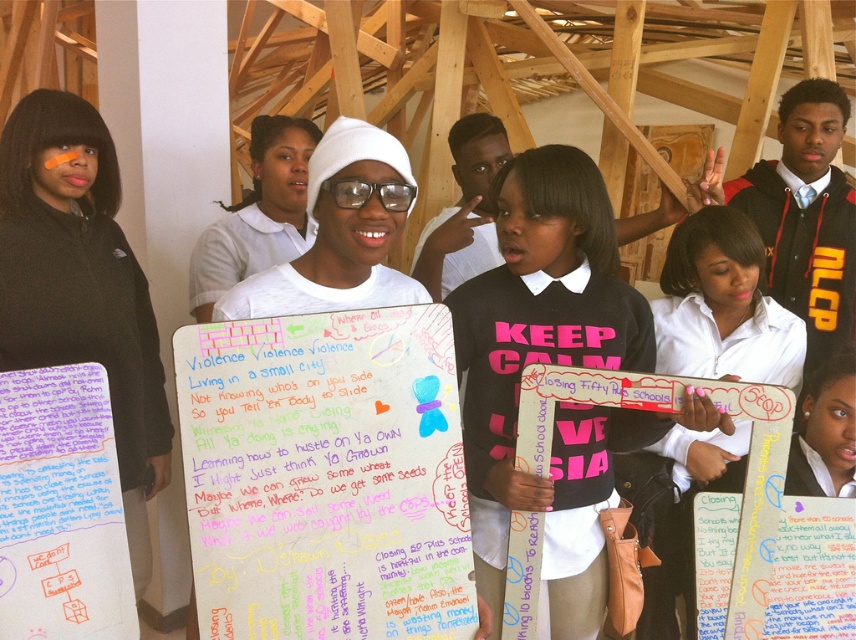
You are a photographer trying to capture the handwritten paper at center and the white matte shirt at center in the same frame. Which object should you focus on first to ensure both are in focus?

Since the handwritten paper at center is smaller than the white matte shirt at center, you should focus on the white matte shirt at center first to ensure both are in focus.

You are standing in the workshop and want to read the text on the white paper poster at center. Is the poster within a comfortable reading distance for you?

The white paper poster at center is 4.14 feet away from the viewer. A comfortable reading distance is typically around 12 to 16 inches, so the poster is too far away to read comfortably.

You are a photographer trying to capture the handwritten paper at center and the white matte shirt at center in a single shot. Based on their positions, which object is closer to the camera?

The handwritten paper at center is positioned under the white matte shirt at center, so the white matte shirt at center is closer to the camera.